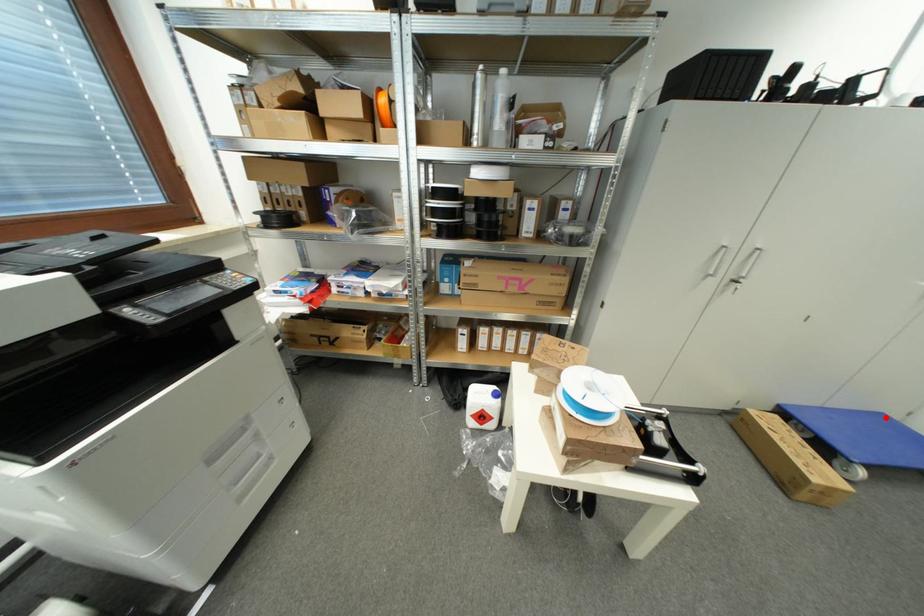
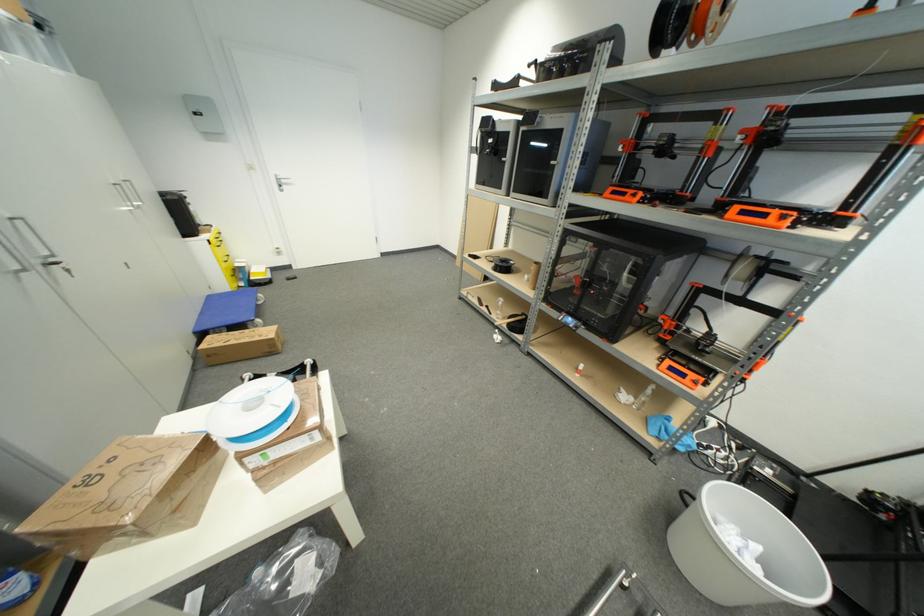
Question: A red point is marked in image1. In image2, is the corresponding 3D point closer to the camera or farther? Reply with the corresponding letter.

Choices:
 (A) The corresponding 3D point is closer.
 (B) The corresponding 3D point is farther.

Answer: (A)